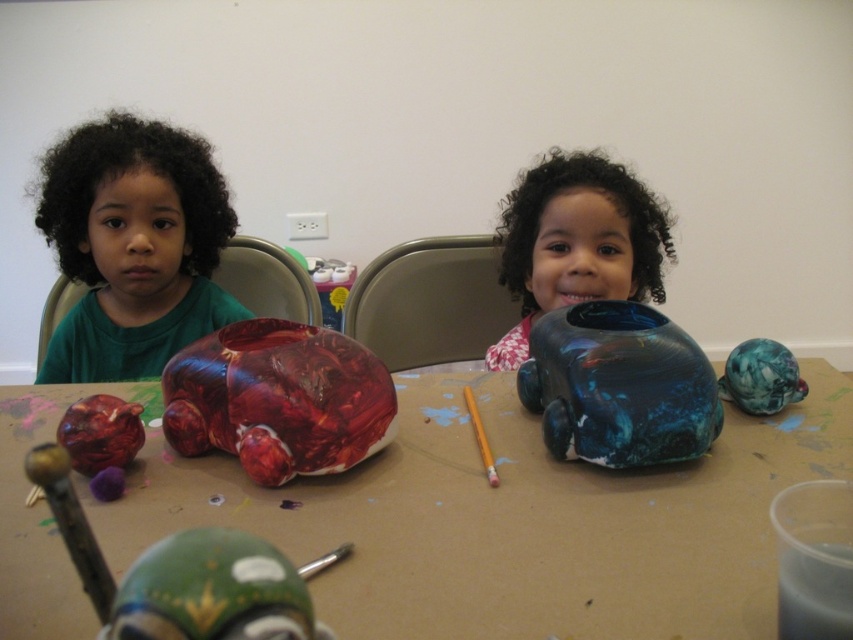
Question: Which object appears farthest from the camera in this image?

Choices:
 (A) shiny plastic car at center
 (B) shiny red car at center
 (C) blue glossy vase at center
 (D) matte green shirt at left

Answer: (D)

Question: Which object is the farthest from the shiny plastic car at center?

Choices:
 (A) shiny red car at center
 (B) glossy ceramic car at center

Answer: (B)

Question: Is glossy ceramic car at center thinner than blue glossy vase at center?

Choices:
 (A) yes
 (B) no

Answer: (A)

Question: Is marbled plastic ball at right bigger than yellow wood pencil at center?

Choices:
 (A) yes
 (B) no

Answer: (A)

Question: Where is shiny red car at center located in relation to glossy ceramic car at center in the image?

Choices:
 (A) below
 (B) above

Answer: (A)

Question: Among these objects, which one is nearest to the camera?

Choices:
 (A) green glossy toy car at lower left
 (B) shiny plastic car at center
 (C) shiny red car at center
 (D) glossy ceramic car at center

Answer: (A)